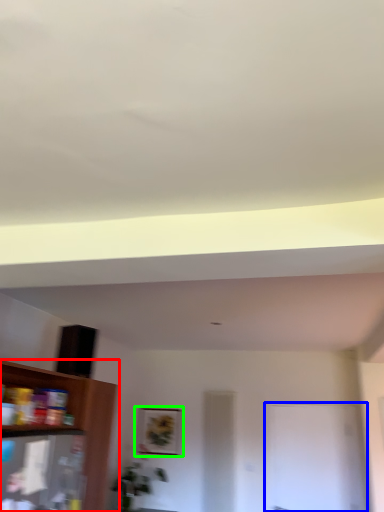
Question: Based on their relative distances, which object is nearer to shelf (highlighted by a red box)? Choose from glass door (highlighted by a blue box) and picture frame (highlighted by a green box).

Choices:
 (A) glass door
 (B) picture frame

Answer: (B)